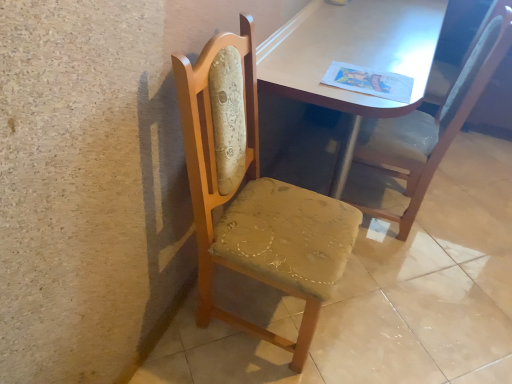
Question: From their relative heights in the image, would you say wooden chair at center is taller or shorter than matte wooden table at center?

Choices:
 (A) tall
 (B) short

Answer: (B)

Question: Is wooden chair at center in front of or behind matte wooden table at center in the image?

Choices:
 (A) front
 (B) behind

Answer: (A)

Question: Which object is positioned closest to the woodenchair at left, the 1th chair in the left-to-right sequence?

Choices:
 (A) wooden chair at center
 (B) matte wooden table at center
 (C) wooden chair at right, the 1th chair viewed from the right

Answer: (B)

Question: Based on their relative distances, which object is farther from the wooden chair at center?

Choices:
 (A) woodenchair at left, the 2th chair in the right-to-left sequence
 (B) wooden chair at right, marked as the 2th chair in a left-to-right arrangement
 (C) matte wooden table at center

Answer: (C)